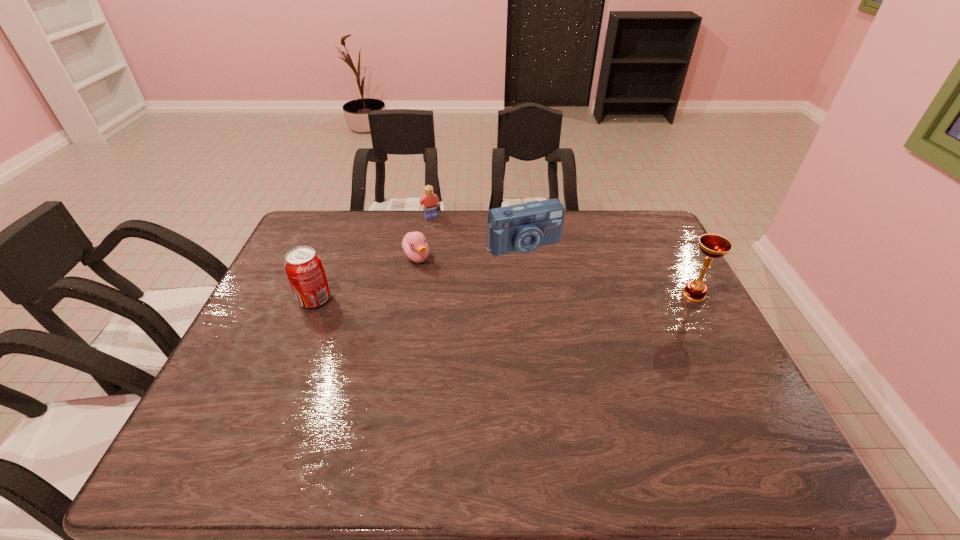
Locate an element on the screen. The height and width of the screenshot is (540, 960). free space on the desktop that is between the leftmost object and the chalice and is positioned on the front-facing side of the shortest object is located at coordinates [450, 298].

What are the coordinates of `free space on the desktop that is between the soda and the rightmost object and is positioned on the front-facing side of the Lego` in the screenshot? It's located at (478, 298).

The image size is (960, 540). I want to click on free space on the desktop that is between the leftmost object and the chalice and is positioned on the lens of the camera, so click(557, 296).